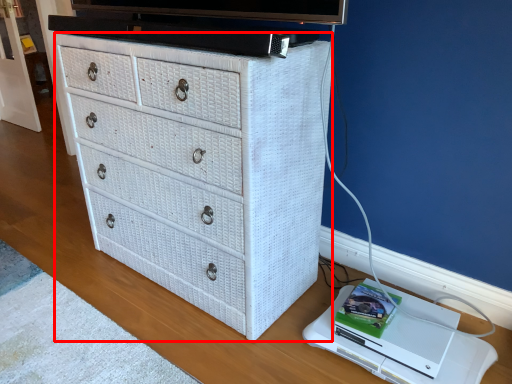
Question: From the image, what is the correct spatial relationship of chest of drawers (annotated by the red box) in relation to computer?

Choices:
 (A) left
 (B) right

Answer: (A)